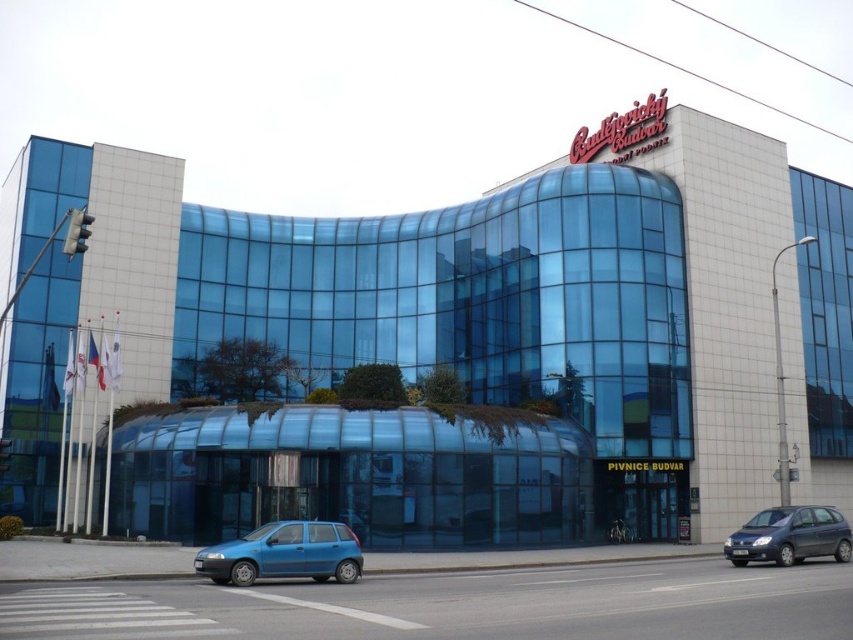
Who is shorter, matte blue hatchback at center or dark gray metallic hatchback at lower right?

Standing shorter between the two is matte blue hatchback at center.

Is point (305, 573) positioned after point (798, 557)?

That is False.

Is point (337, 568) closer to camera compared to point (733, 557)?

Yes, point (337, 568) is closer to viewer.

I want to click on matte blue hatchback at center, so click(283, 554).

Between transparent glass building at center and matte blue hatchback at center, which one is positioned higher?

transparent glass building at center is higher up.

At what (x,y) coordinates should I click in order to perform the action: click on transparent glass building at center. Please return your answer as a coordinate pair (x, y). Image resolution: width=853 pixels, height=640 pixels. Looking at the image, I should click on (444, 346).

Is point (567, 508) behind point (785, 529)?

Yes, it is.

At what (x,y) coordinates should I click in order to perform the action: click on transparent glass building at center. Please return your answer as a coordinate pair (x, y). The width and height of the screenshot is (853, 640). Looking at the image, I should click on (444, 346).